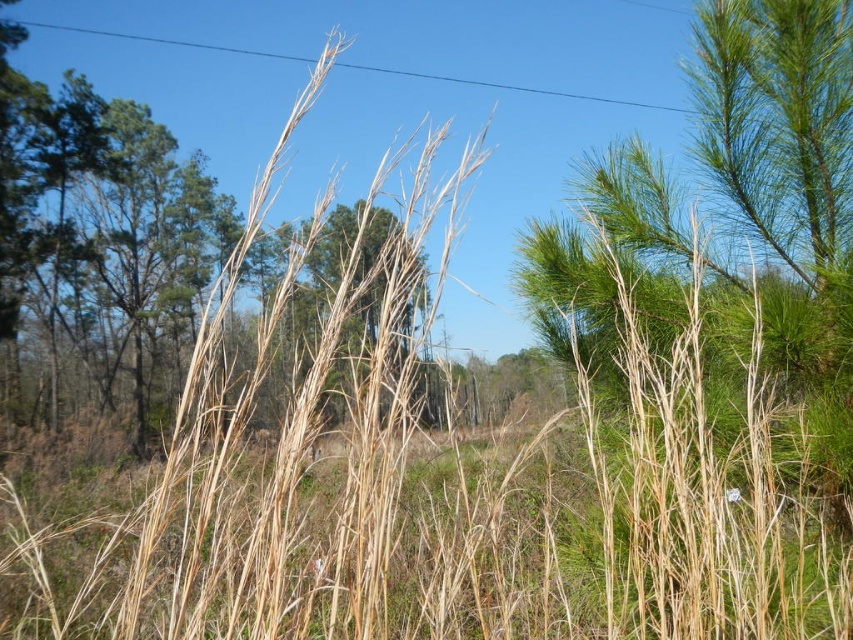
Question: Among these objects, which one is farthest from the camera?

Choices:
 (A) dry straw grass at center
 (B) dry grass at center

Answer: (A)

Question: From the image, what is the correct spatial relationship of dry straw grass at center in relation to dry grass at center?

Choices:
 (A) left
 (B) right

Answer: (B)

Question: Which point is farther to the camera?

Choices:
 (A) (328, 552)
 (B) (404, 225)

Answer: (A)

Question: Observing the image, what is the correct spatial positioning of dry straw grass at center in reference to dry grass at center?

Choices:
 (A) above
 (B) below

Answer: (B)

Question: Does dry straw grass at center have a lesser width compared to dry grass at center?

Choices:
 (A) yes
 (B) no

Answer: (A)

Question: Which point is closer to the camera taking this photo?

Choices:
 (A) (593, 516)
 (B) (250, 563)

Answer: (B)